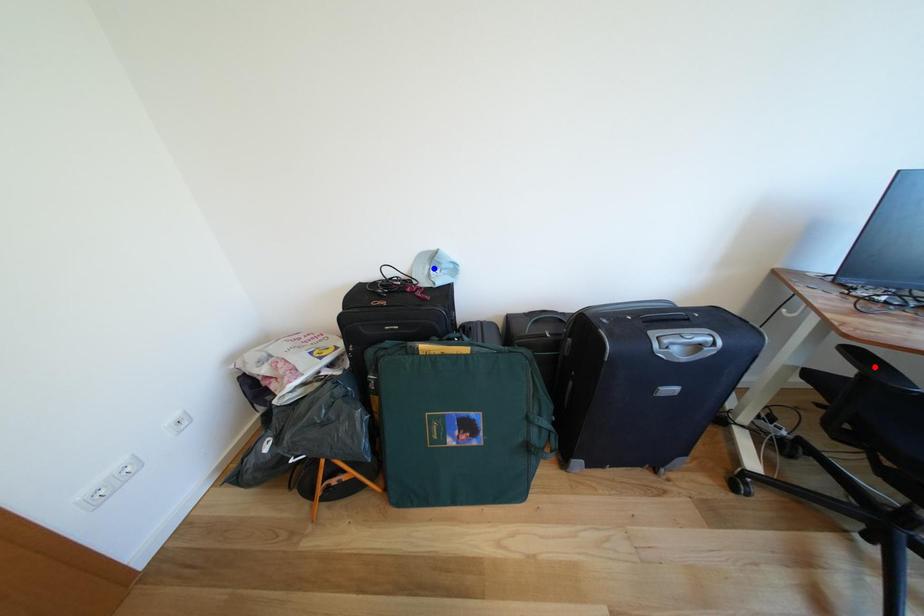
Question: In the image, two points are highlighted. Which point is nearer to the camera? Reply with the corresponding letter.

Choices:
 (A) blue point
 (B) red point

Answer: (B)